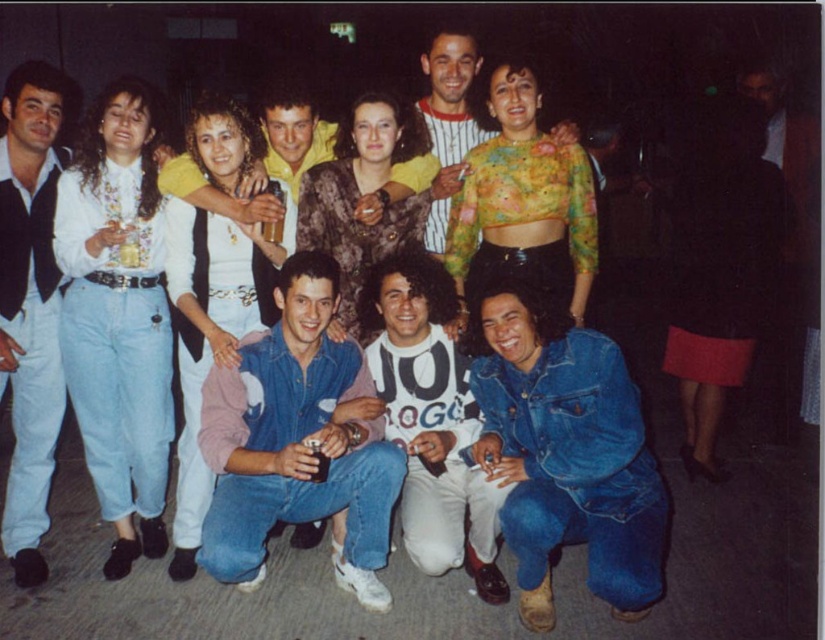
Consider the image. You are organizing a charity event and need to display two outfits from the image. The denim jacket at lower right and the floral sheer top at center must be placed on adjacent mannequins. Considering their sizes, which outfit should be placed on the smaller mannequin?

The denim jacket at lower right has a smaller size compared to the floral sheer top at center, so it should be placed on the smaller mannequin.

You are a photographer trying to capture a candid shot of the group. You notice two points in the image at coordinates point (149, 154) and point (323, 240). If you want to focus on the closer point to the viewer, which coordinate should you aim your camera at?

Point (149, 154) is further to the viewer than point (323, 240), so you should aim your camera at point (149, 154) to focus on the closer point.

You are a photographer at the party and want to take a group photo. You are standing 2 meters away from the white matte shirt at left. Can you fit everyone in the frame if your camera has a maximum range of 5 meters?

The distance between you and the white matte shirt at left is 2 meters, and they are 3.00 meters apart from each other. Since the total distance from you to the farthest person would be 2 meters plus 3 meters, totaling 5 meters, which is within the camera range. Therefore, everyone can be captured in the frame.